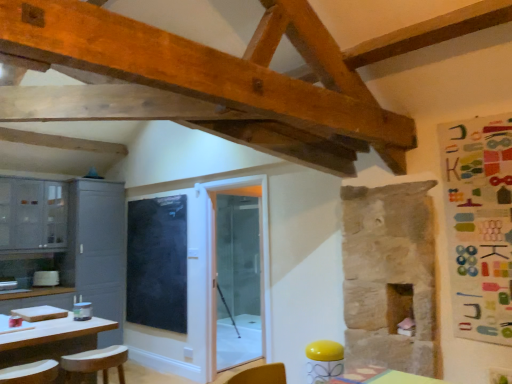
This screenshot has height=384, width=512. Identify the location of blank space situated above black matte chalkboard at center (from a real-world perspective). (151, 197).